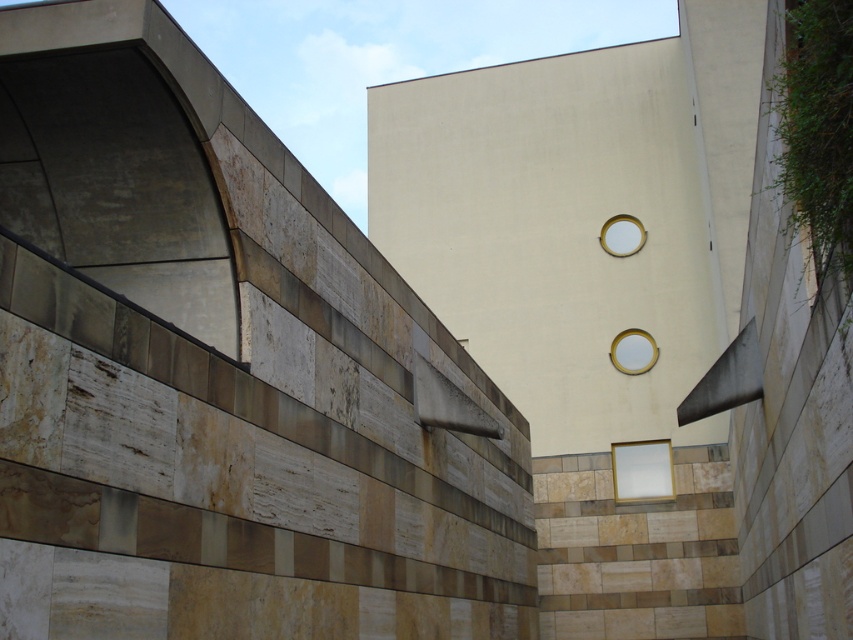
You are an architect designing a new building and want to place a matte gold circle at center in the scene. According to the provided coordinates, where exactly should you position it?

The matte gold circle at center should be positioned at coordinates point (x=633, y=352) as specified in the description.

From the picture: You are an architect designing a new building and you want to place two matte gold circles in the design. The first one is the matte gold circle at center and the second is the matte gold circle at upper center. Which of these two matte gold circles has a greater thickness?

The matte gold circle at upper center has a greater thickness than the matte gold circle at center.

What object is located at the coordinates point [633,352]?

The point [633,352] corresponds to the matte gold circle at center.